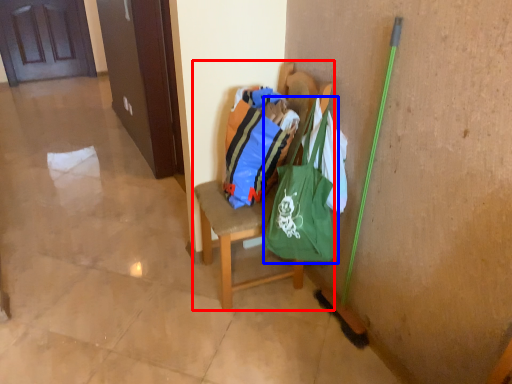
Question: Which point is closer to the camera, chair (highlighted by a red box) or shoulder bag (highlighted by a blue box)?

Choices:
 (A) chair
 (B) shoulder bag

Answer: (B)